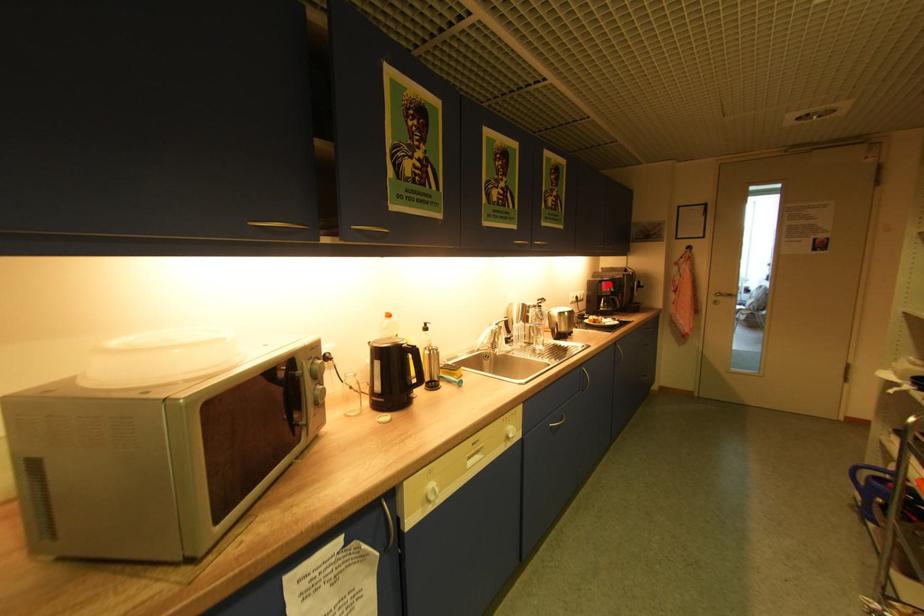
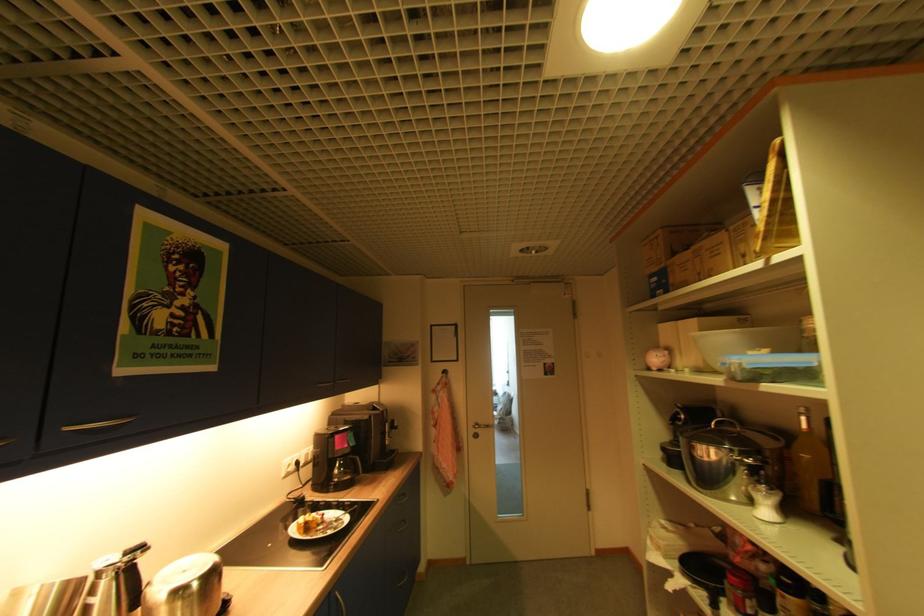
Locate, in the second image, the point that corresponds to the highlighted location in the first image.

(343, 437)